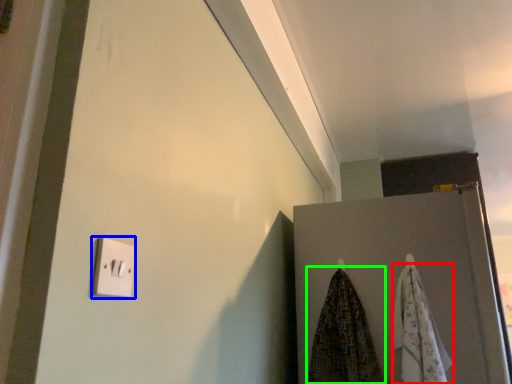
Question: Which object is the closest to the beach towel (highlighted by a red box)? Choose among these: light switch (highlighted by a blue box) or beach towel (highlighted by a green box).

Choices:
 (A) light switch
 (B) beach towel

Answer: (B)